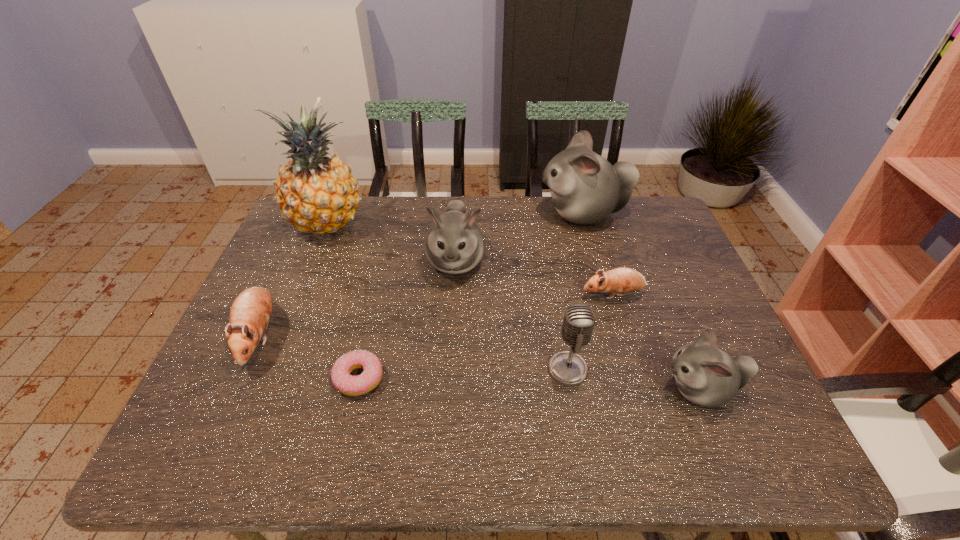
The width and height of the screenshot is (960, 540). What are the coordinates of `yellow pineapple` in the screenshot? It's located at (x=316, y=192).

At what (x,y) coordinates should I click in order to perform the action: click on pineapple. Please return your answer as a coordinate pair (x, y). Looking at the image, I should click on (316, 192).

The width and height of the screenshot is (960, 540). I want to click on the farthest hamster, so click(585, 188).

Find the location of `the biggest white hamster`. the biggest white hamster is located at coordinates (585, 188).

This screenshot has height=540, width=960. I want to click on the fifth object from right to left, so click(454, 244).

This screenshot has width=960, height=540. I want to click on the fourth hamster from right to left, so click(x=454, y=244).

Image resolution: width=960 pixels, height=540 pixels. I want to click on microphone, so click(568, 368).

You are a GUI agent. You are given a task and a screenshot of the screen. Output one action in this format:
    pyautogui.click(x=<x>, y=<y>)
    Task: Click on the third shortest hamster
    
    Given the screenshot: What is the action you would take?
    pyautogui.click(x=706, y=375)

Where is `the smallest white hamster`? the smallest white hamster is located at coordinates (706, 375).

Locate an element on the screen. The image size is (960, 540). the sixth tallest object is located at coordinates (250, 313).